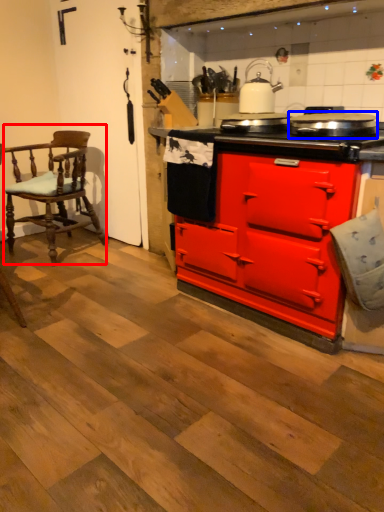
Question: Which point is further to the camera, chair (highlighted by a red box) or appliance (highlighted by a blue box)?

Choices:
 (A) chair
 (B) appliance

Answer: (A)